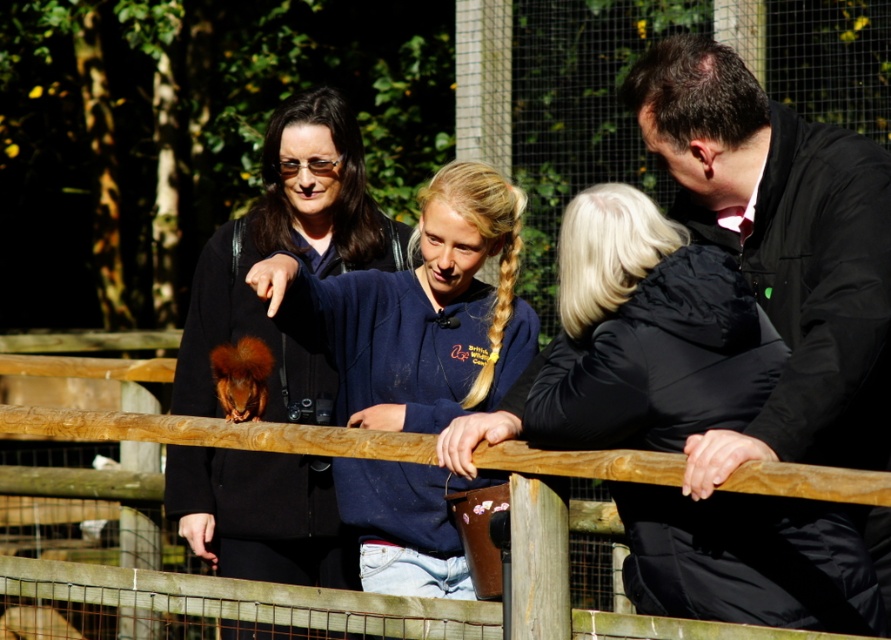
You are a zoo visitor trying to identify which jacket is closer to the ground between the matte black jacket at center and the blue fleece jacket at center. Based on the scene, which one is lower?

The matte black jacket at center is located below the blue fleece jacket at center, so the matte black jacket at center is closer to the ground.

Consider the image. You are standing at the point labeled point (669, 595) and want to move to the point labeled point (672, 141). Which direction should you face to walk towards your destination?

You should face left because point (669, 595) is closer to the viewer than point (672, 141), so moving left would take you towards the farther point.